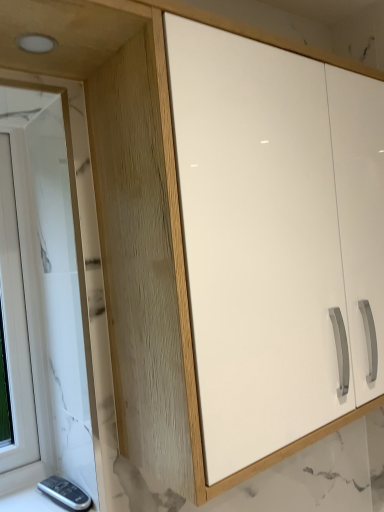
Question: Is white marble window at left behind white glossy cabinet at center?

Choices:
 (A) no
 (B) yes

Answer: (B)

Question: Does white marble window at left have a greater height compared to white glossy cabinet at center?

Choices:
 (A) yes
 (B) no

Answer: (A)

Question: Is white marble window at left shorter than white glossy cabinet at center?

Choices:
 (A) no
 (B) yes

Answer: (A)

Question: Is white marble window at left positioned with its back to white glossy cabinet at center?

Choices:
 (A) no
 (B) yes

Answer: (A)

Question: Is white marble window at left next to white glossy cabinet at center?

Choices:
 (A) yes
 (B) no

Answer: (B)

Question: From the image's perspective, is white marble window at left under white glossy cabinet at center?

Choices:
 (A) yes
 (B) no

Answer: (A)

Question: Is white glossy cabinet at center further to camera compared to white marble window at left?

Choices:
 (A) yes
 (B) no

Answer: (B)

Question: Considering the relative sizes of white glossy cabinet at center and white marble window at left in the image provided, is white glossy cabinet at center shorter than white marble window at left?

Choices:
 (A) yes
 (B) no

Answer: (A)

Question: Is white glossy cabinet at center oriented away from white marble window at left?

Choices:
 (A) yes
 (B) no

Answer: (A)

Question: Does white glossy cabinet at center have a smaller size compared to white marble window at left?

Choices:
 (A) no
 (B) yes

Answer: (A)

Question: Could you tell me if white glossy cabinet at center is facing white marble window at left?

Choices:
 (A) yes
 (B) no

Answer: (B)

Question: Considering the relative positions of white glossy cabinet at center and white marble window at left in the image provided, is white glossy cabinet at center to the right of white marble window at left from the viewer's perspective?

Choices:
 (A) no
 (B) yes

Answer: (B)

Question: Considering the relative positions of white marble window at left and white glossy cabinet at center in the image provided, is white marble window at left to the left or to the right of white glossy cabinet at center?

Choices:
 (A) left
 (B) right

Answer: (A)